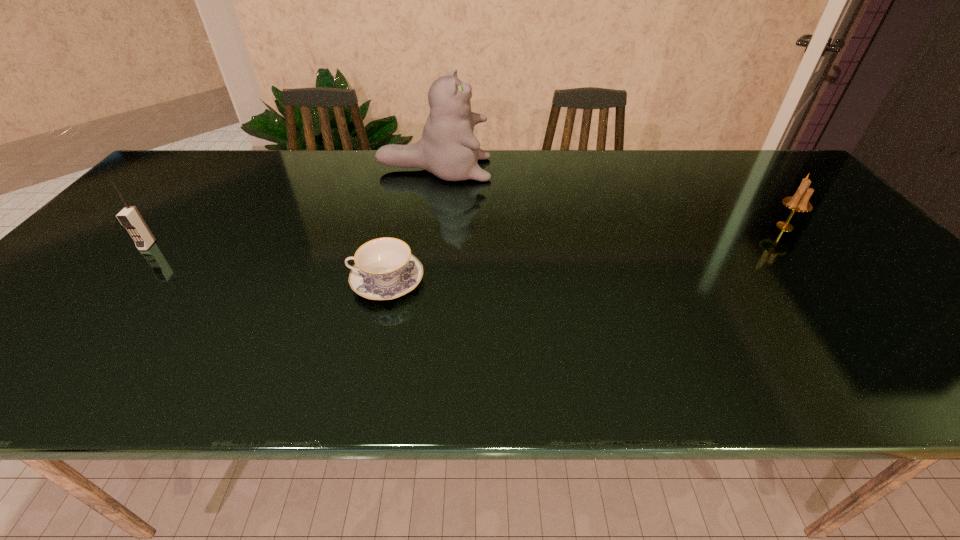
You are a GUI agent. You are given a task and a screenshot of the screen. Output one action in this format:
    pyautogui.click(x=<x>, y=<y>)
    Task: Click on the free space that satisfies the following two spatial constraints: 1. with the handle on the side of the shortest object; 2. on the front-facing side of the cellular telephone
    This screenshot has width=960, height=540.
    Given the screenshot: What is the action you would take?
    pyautogui.click(x=395, y=245)

This screenshot has height=540, width=960. I want to click on vacant space that satisfies the following two spatial constraints: 1. on the face of the cat; 2. on the front-facing side of the cellular telephone, so click(422, 245).

Identify the location of vacant point that satisfies the following two spatial constraints: 1. on the face of the third nearest object; 2. on the left side of the cat. (425, 226).

You are a GUI agent. You are given a task and a screenshot of the screen. Output one action in this format:
    pyautogui.click(x=<x>, y=<y>)
    Task: Click on the vacant space that satisfies the following two spatial constraints: 1. with the handle on the side of the nearest object; 2. on the back side of the third nearest object
    
    Given the screenshot: What is the action you would take?
    (x=399, y=226)